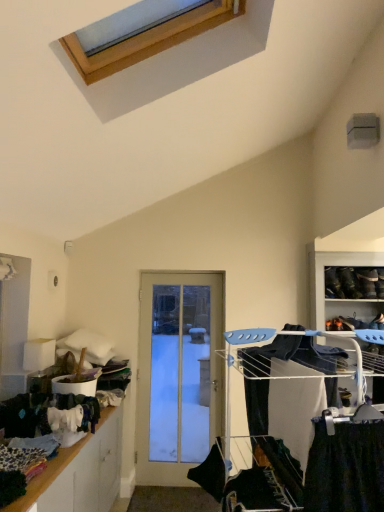
Find the location of `white glass door at center`. white glass door at center is located at coordinates (178, 373).

You are a GUI agent. You are given a task and a screenshot of the screen. Output one action in this format:
    pyautogui.click(x=<x>, y=<y>)
    Task: Click on the white metal drying rack at right
    The height and width of the screenshot is (512, 384).
    Given the screenshot: What is the action you would take?
    pyautogui.click(x=304, y=432)

Between point (286, 442) and point (206, 490), which one is positioned in front?

The point (206, 490) is closer to the camera.

Considering the sizes of white metal drying rack at right and black fabric at center in the image, is white metal drying rack at right wider or thinner than black fabric at center?

Clearly, white metal drying rack at right has more width compared to black fabric at center.

Considering their positions, is white metal drying rack at right located in front of or behind black fabric at center?

In the image, white metal drying rack at right appears in front of black fabric at center.

Are white metal drying rack at right and black fabric at center located far from each other?

white metal drying rack at right is actually quite close to black fabric at center.

From the image's perspective, which one is positioned higher, wooden shelf at lower left or black fabric at center?

From the image's view, black fabric at center is above.

Does wooden shelf at lower left come behind black fabric at center?

No, it is in front of black fabric at center.

Is wooden shelf at lower left shorter than black fabric at center?

In fact, wooden shelf at lower left may be taller than black fabric at center.

Is wooden shelf at lower left positioned far away from black fabric at center?

Yes, wooden shelf at lower left and black fabric at center are quite far apart.

Does black fabric at center have a greater width compared to wooden shelf at lower left?

Incorrect, the width of black fabric at center does not surpass that of wooden shelf at lower left.

Consider the image. Between black fabric at center and wooden shelf at lower left, which one has larger size?

wooden shelf at lower left is bigger.

Is black fabric at center looking in the opposite direction of wooden shelf at lower left?

black fabric at center is not turned away from wooden shelf at lower left.

Is black fabric at center situated inside wooden shelf at lower left or outside?

The correct answer is: outside.

Is wooden shelf at lower left facing towards white glass door at center?

No, wooden shelf at lower left is not oriented towards white glass door at center.

Between wooden shelf at lower left and white glass door at center, which one has larger width?

wooden shelf at lower left is wider.

Is wooden shelf at lower left bigger than white glass door at center?

Yes, wooden shelf at lower left is bigger than white glass door at center.

From the picture: Is wooden shelf at lower left far from white glass door at center?

Yes, wooden shelf at lower left is far from white glass door at center.

From a real-world perspective, which is physically above, black fabric at center or white glass door at center?

white glass door at center is physically above.

From the image's perspective, which one is positioned lower, black fabric at center or white glass door at center?

white glass door at center appears lower in the image.

Identify the location of door above the black fabric at center (from a real-world perspective). (178, 373).

Choose the correct answer: Is black fabric at center inside white metal drying rack at right or outside it?

black fabric at center lies within the bounds of white metal drying rack at right.

From the image's perspective, is black fabric at center positioned above or below white metal drying rack at right?

black fabric at center is below white metal drying rack at right.

Is point (206, 468) positioned behind point (300, 351)?

Yes, it is behind point (300, 351).

Does black fabric at center have a greater height compared to white metal drying rack at right?

In fact, black fabric at center may be shorter than white metal drying rack at right.

Which is behind, point (147, 482) or point (258, 421)?

The point (147, 482) is farther.

Is white glass door at center positioned before white metal drying rack at right?

No.

Image resolution: width=384 pixels, height=512 pixels. I want to click on door behind the white metal drying rack at right, so click(178, 373).

The height and width of the screenshot is (512, 384). In order to click on clothing on the left of white metal drying rack at right in this screenshot , I will do `click(211, 472)`.

Find the location of `clothing that appears on the right of wooden shelf at lower left`. clothing that appears on the right of wooden shelf at lower left is located at coordinates (211, 472).

Estimate the real-world distances between objects in this image. Which object is further from wooden shelf at lower left, white metal drying rack at right or black fabric at center?

Among the two, white metal drying rack at right is located further to wooden shelf at lower left.

From the image, which object appears to be farther from black fabric at center, white glass door at center or wooden shelf at lower left?

white glass door at center is positioned further to the anchor black fabric at center.

Considering their positions, is white metal drying rack at right positioned further to black fabric at center than white glass door at center?

white glass door at center is positioned further to the anchor black fabric at center.

Estimate the real-world distances between objects in this image. Which object is closer to black fabric at center, wooden shelf at lower left or white metal drying rack at right?

Among the two, white metal drying rack at right is located nearer to black fabric at center.

Based on their spatial positions, is wooden shelf at lower left or black fabric at center closer to white metal drying rack at right?

The object closer to white metal drying rack at right is black fabric at center.

In the scene shown: Based on their spatial positions, is black fabric at center or wooden shelf at lower left further from white metal drying rack at right?

wooden shelf at lower left.

Considering their positions, is white metal drying rack at right positioned further to black fabric at center than wooden shelf at lower left?

Based on the image, wooden shelf at lower left appears to be further to black fabric at center.

Estimate the real-world distances between objects in this image. Which object is further from white glass door at center, black fabric at center or white metal drying rack at right?

black fabric at center is further to white glass door at center.

This screenshot has width=384, height=512. Find the location of `clothing located between white metal drying rack at right and white glass door at center in the depth direction`. clothing located between white metal drying rack at right and white glass door at center in the depth direction is located at coordinates (211, 472).

The width and height of the screenshot is (384, 512). In order to click on clothing located between wooden shelf at lower left and white glass door at center in the depth direction in this screenshot , I will do `click(211, 472)`.

Locate an element on the screen. The image size is (384, 512). cabinetry positioned between white metal drying rack at right and white glass door at center from near to far is located at coordinates (80, 473).

In order to click on clothing between wooden shelf at lower left and white metal drying rack at right in the horizontal direction in this screenshot , I will do `click(211, 472)`.